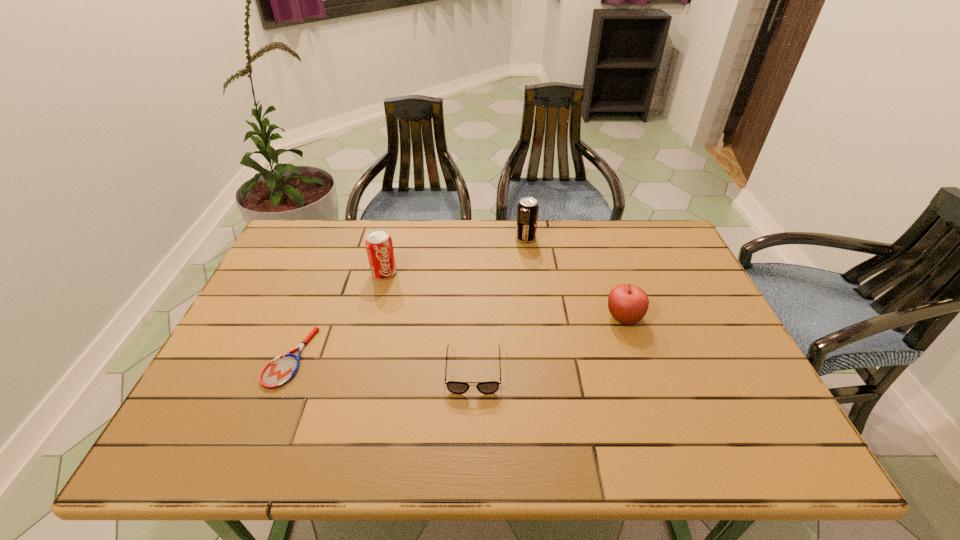
You are a GUI agent. You are given a task and a screenshot of the screen. Output one action in this format:
    pyautogui.click(x=<x>, y=<y>)
    Task: Click on the vacant area situated on the front of the farther soda can
    The image size is (960, 540).
    Given the screenshot: What is the action you would take?
    pyautogui.click(x=528, y=256)

The width and height of the screenshot is (960, 540). I want to click on blank space located on the right of the second farthest object, so click(x=477, y=273).

Image resolution: width=960 pixels, height=540 pixels. What are the coordinates of `free space located on the front of the rightmost object` in the screenshot? It's located at (657, 415).

This screenshot has height=540, width=960. In order to click on vacant area situated on the front-facing side of the fourth tallest object in this screenshot , I will do `click(472, 460)`.

Find the location of a particular element. The image size is (960, 540). vacant region located 0.160m on the right of the tennis racket is located at coordinates (375, 357).

Identify the location of object present at the far edge. The width and height of the screenshot is (960, 540). (527, 209).

Locate an element on the screen. The width and height of the screenshot is (960, 540). object located at the left edge is located at coordinates (278, 372).

In order to click on vacant region at the far edge of the desktop in this screenshot , I will do `click(353, 252)`.

You are a GUI agent. You are given a task and a screenshot of the screen. Output one action in this format:
    pyautogui.click(x=<x>, y=<y>)
    Task: Click on the vacant space at the near edge of the desktop
    
    Given the screenshot: What is the action you would take?
    pyautogui.click(x=252, y=458)

Identify the location of vacant space at the left edge of the desktop. The height and width of the screenshot is (540, 960). (292, 285).